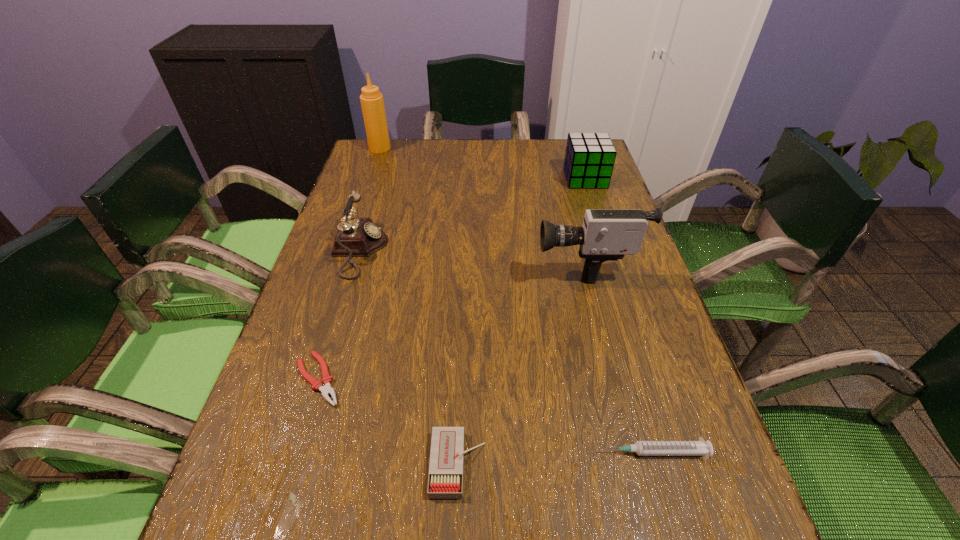
I want to click on the tallest object, so click(372, 103).

Where is `condiment`? This screenshot has height=540, width=960. condiment is located at coordinates (372, 103).

Where is `the sixth shortest object`? This screenshot has width=960, height=540. the sixth shortest object is located at coordinates (606, 234).

At what (x,y) coordinates should I click in order to perform the action: click on the second farthest object. Please return your answer as a coordinate pair (x, y). This screenshot has height=540, width=960. Looking at the image, I should click on (589, 159).

Where is `telephone`? telephone is located at coordinates [x=357, y=237].

Identify the location of the fourth object from left to right. The height and width of the screenshot is (540, 960). (445, 481).

Where is `matchbox`? matchbox is located at coordinates (445, 481).

Find the location of a particular element. the second shortest object is located at coordinates (x=642, y=448).

The image size is (960, 540). Find the location of `the third nearest object`. the third nearest object is located at coordinates (326, 390).

What are the coordinates of `pliers` in the screenshot? It's located at (326, 390).